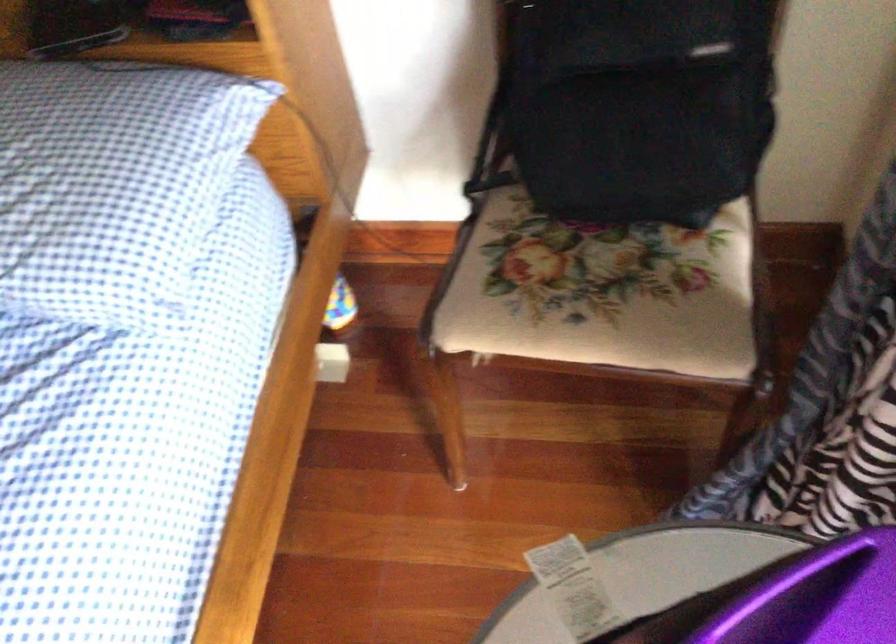
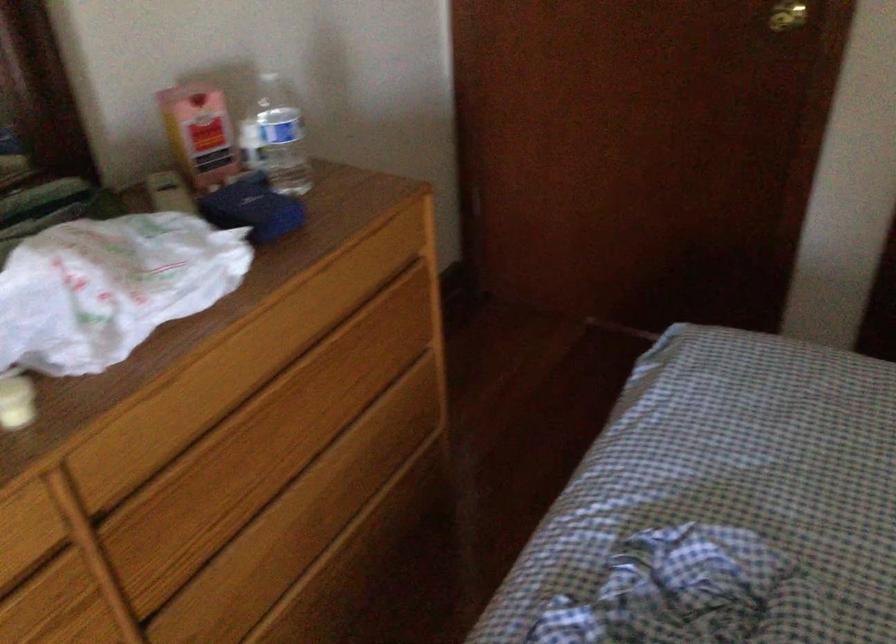
Based on the continuous images, in which direction is the camera rotating?

The rotation direction of the camera is left-down.